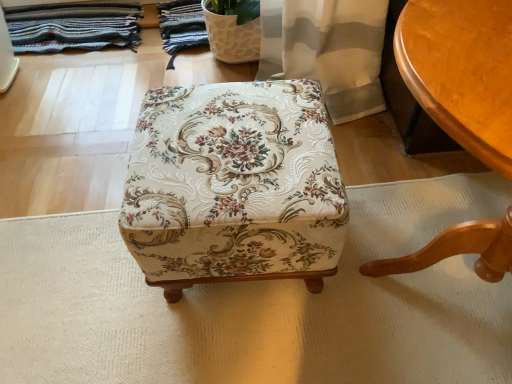
You are a GUI agent. You are given a task and a screenshot of the screen. Output one action in this format:
    pyautogui.click(x=<x>, y=<y>)
    Task: Click on the vacant region above floral fabric ottoman at center (from a real-world perspective)
    This screenshot has height=384, width=512.
    Given the screenshot: What is the action you would take?
    pyautogui.click(x=234, y=141)